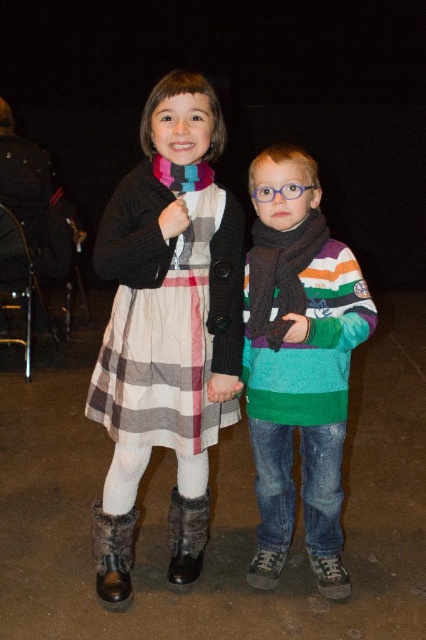
The image size is (426, 640). Describe the element at coordinates (299, 364) in the screenshot. I see `striped sweater at center` at that location.

Consider the image. Does striped sweater at center lie behind multicolored knitted scarf at center?

That is False.

Is point (333, 250) positioned behind point (158, 176)?

Yes.

I want to click on striped sweater at center, so click(299, 364).

Can you confirm if furry black boot at lower left is positioned to the right of black fuzzy boot at lower center?

In fact, furry black boot at lower left is to the left of black fuzzy boot at lower center.

Does furry black boot at lower left have a greater height compared to black fuzzy boot at lower center?

No.

Who is more distant from viewer, [123,516] or [201,532]?

The point [201,532] is behind.

The height and width of the screenshot is (640, 426). I want to click on furry black boot at lower left, so click(x=112, y=556).

Between point (264, 230) and point (100, 536), which one is positioned in front?

Positioned in front is point (264, 230).

Between point (322, 230) and point (115, 524), which one is positioned behind?

Point (115, 524)

You are a GUI agent. You are given a task and a screenshot of the screen. Output one action in this format:
    pyautogui.click(x=<x>, y=<y>)
    Task: Click on the brown woolen scarf at center
    This screenshot has height=640, width=426.
    Given the screenshot: What is the action you would take?
    pyautogui.click(x=281, y=275)